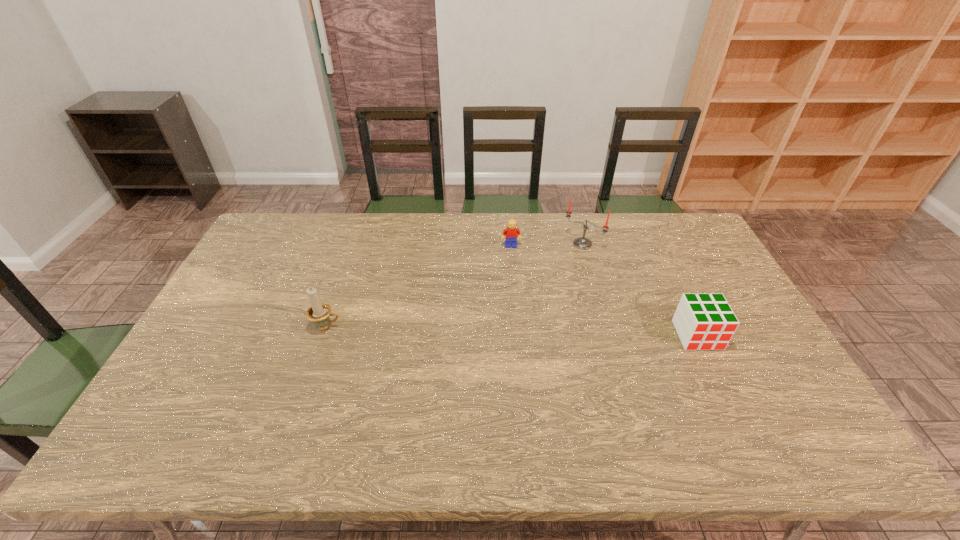
Where is `vacant space on the desktop that is between the candle_holder and the rightmost object and is positioned on the face of the second object from left to right`? This screenshot has height=540, width=960. vacant space on the desktop that is between the candle_holder and the rightmost object and is positioned on the face of the second object from left to right is located at coordinates (523, 331).

You are a GUI agent. You are given a task and a screenshot of the screen. Output one action in this format:
    pyautogui.click(x=<x>, y=<y>)
    Task: Click on the vacant space on the desktop that is between the candle_holder and the cube and is positioned on the front-facing side of the candle
    This screenshot has height=540, width=960.
    Given the screenshot: What is the action you would take?
    pyautogui.click(x=497, y=330)